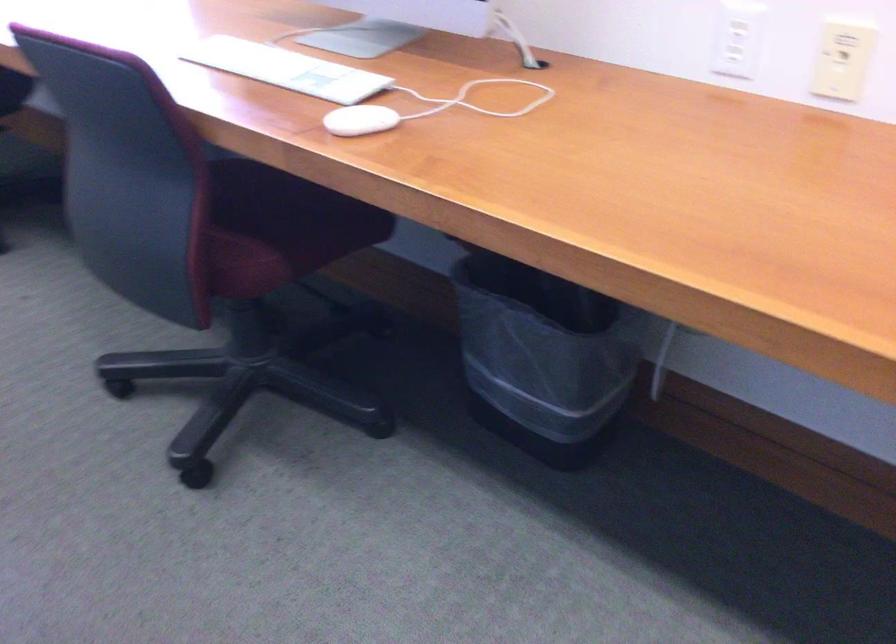
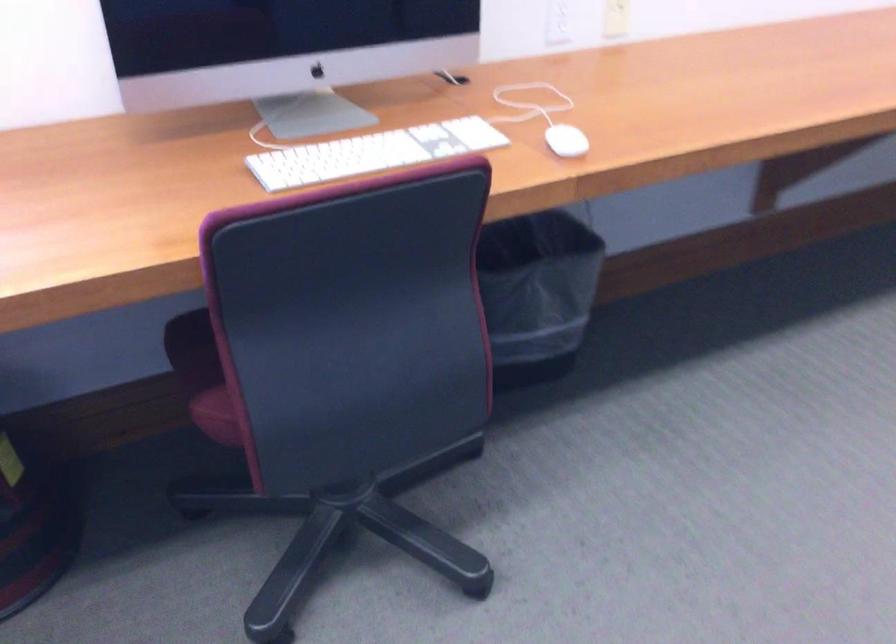
Where in the second image is the point corresponding to pixel 113 202 from the first image?

(220, 413)